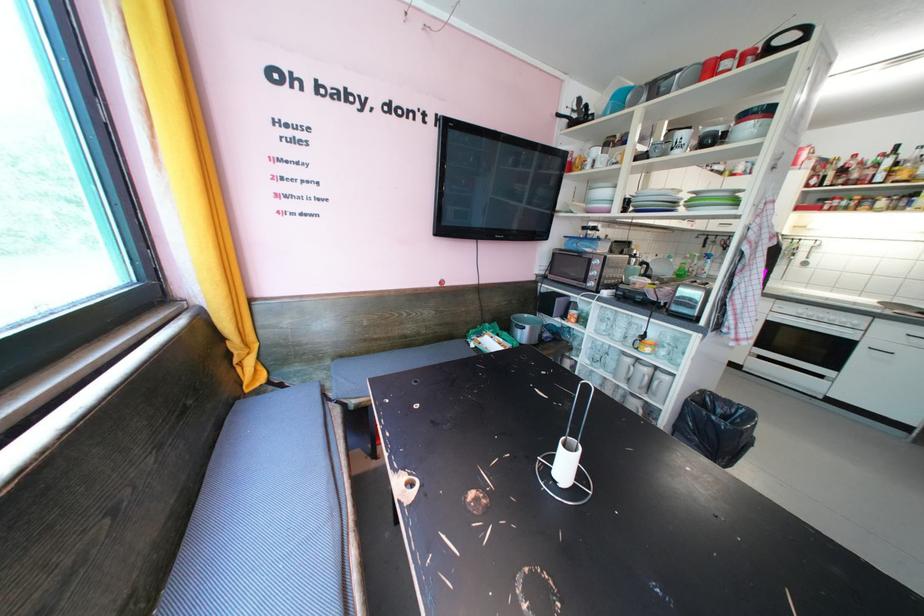
Locate an element on the screen. The image size is (924, 616). oven door handle is located at coordinates (813, 325).